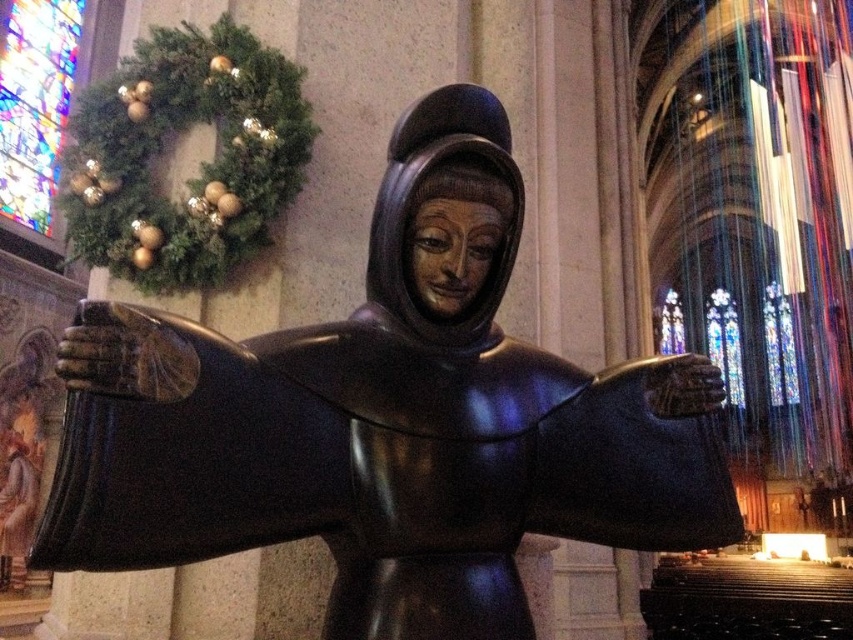
Question: Is stained glass window at upper left behind stained glass window at upper right?

Choices:
 (A) yes
 (B) no

Answer: (B)

Question: Does shiny bronze statue at center appear under stained glass window at upper right?

Choices:
 (A) yes
 (B) no

Answer: (B)

Question: Which object is positioned closest to the shiny bronze statue at center?

Choices:
 (A) stained glass window at upper right
 (B) stained glass window at upper left

Answer: (B)

Question: Can you confirm if shiny bronze statue at center is positioned below stained glass window at upper left?

Choices:
 (A) yes
 (B) no

Answer: (A)

Question: Considering the real-world distances, which object is farthest from the stained glass window at upper right?

Choices:
 (A) shiny bronze statue at center
 (B) stained glass window at upper left

Answer: (A)

Question: Considering the real-world distances, which object is farthest from the shiny bronze statue at center?

Choices:
 (A) stained glass window at upper right
 (B) stained glass window at upper left

Answer: (A)